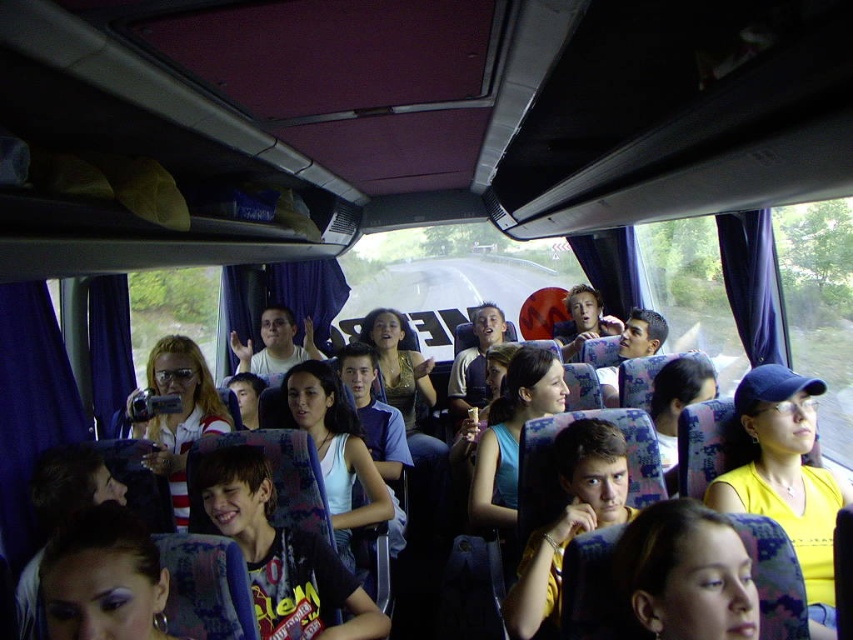
Measure the distance between point (757, 422) and camera.

Point (757, 422) is 7.24 feet away from camera.

Is yellow matte shirt at center below smooth yellow shirt at lower right?

Yes.

What do you see at coordinates (785, 477) in the screenshot? This screenshot has height=640, width=853. I see `yellow matte shirt at center` at bounding box center [785, 477].

Where is `yellow matte shirt at center`? This screenshot has height=640, width=853. yellow matte shirt at center is located at coordinates (785, 477).